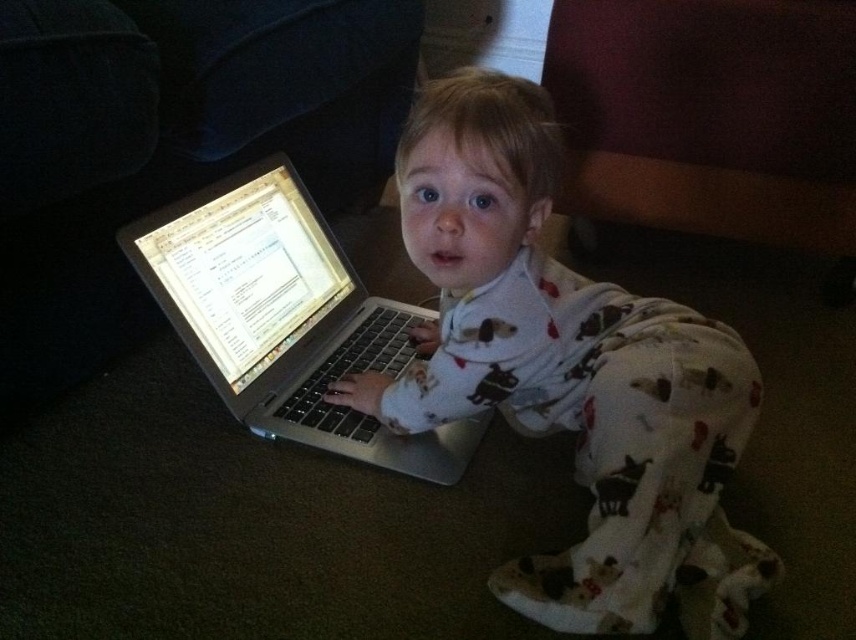
Question: Does white soft pajamas at center have a larger size compared to silver metallic laptop at center?

Choices:
 (A) yes
 (B) no

Answer: (A)

Question: Which of the following is the closest to the observer?

Choices:
 (A) (270, 204)
 (B) (597, 609)

Answer: (B)

Question: Can you confirm if white soft pajamas at center is positioned below silver metallic laptop at center?

Choices:
 (A) yes
 (B) no

Answer: (A)

Question: Considering the relative positions of white soft pajamas at center and silver metallic laptop at center in the image provided, where is white soft pajamas at center located with respect to silver metallic laptop at center?

Choices:
 (A) left
 (B) right

Answer: (B)